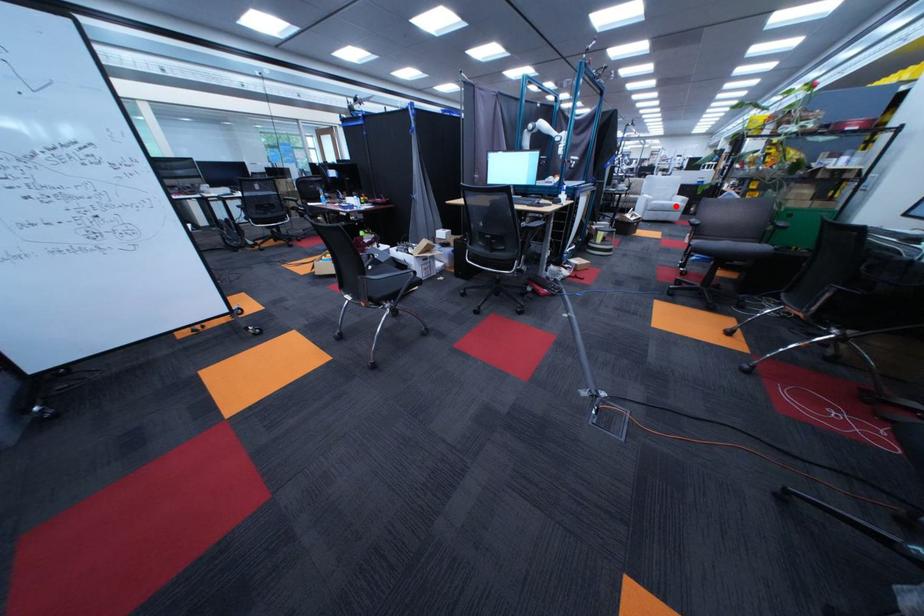
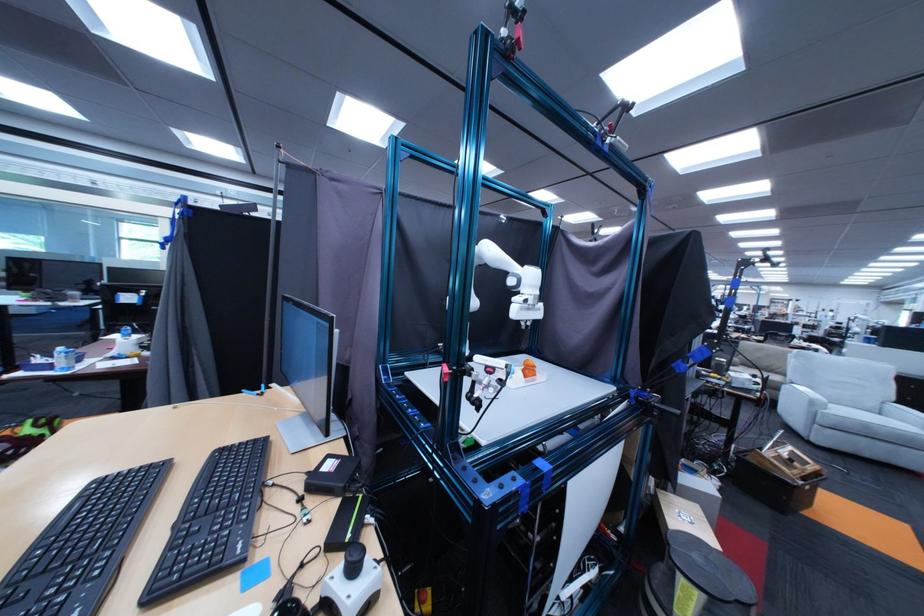
Question: I am providing you with two images of the same scene from different viewpoints. Image1 has a red point marked. In image2, the corresponding 3D location appears at what relative position? Reply with the corresponding letter.

Choices:
 (A) Closer
 (B) Farther

Answer: (B)